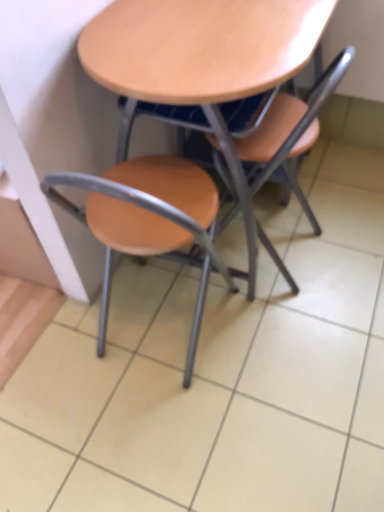
Question: Which direction should I rotate to look at matte wood chair at center, marked as the 2th chair in a right-to-left arrangement?

Choices:
 (A) right
 (B) left

Answer: (B)

Question: From the image's perspective, would you say wooden at center is shown under matte wood chair at center, acting as the first chair starting from the right?

Choices:
 (A) yes
 (B) no

Answer: (B)

Question: From a real-world perspective, is wooden at center on matte wood chair at center, which is the second chair in left-to-right order?

Choices:
 (A) yes
 (B) no

Answer: (A)

Question: From the image's perspective, is wooden at center on top of matte wood chair at center, which is the second chair in left-to-right order?

Choices:
 (A) yes
 (B) no

Answer: (A)

Question: Can matte wood chair at center, which is the second chair in left-to-right order, be found inside wooden at center?

Choices:
 (A) no
 (B) yes

Answer: (B)

Question: Can you confirm if wooden at center is smaller than matte wood chair at center, which is the second chair in left-to-right order?

Choices:
 (A) no
 (B) yes

Answer: (A)

Question: Is wooden at center touching matte wood chair at center, acting as the first chair starting from the right?

Choices:
 (A) no
 (B) yes

Answer: (A)

Question: From the image's perspective, is matte wood chair at center, acting as the first chair starting from the right, located beneath matte wood chair at center, the 1th chair when ordered from left to right?

Choices:
 (A) yes
 (B) no

Answer: (B)

Question: Is matte wood chair at center, acting as the first chair starting from the right, oriented towards matte wood chair at center, marked as the 2th chair in a right-to-left arrangement?

Choices:
 (A) yes
 (B) no

Answer: (B)

Question: Is matte wood chair at center, acting as the first chair starting from the right, further to camera compared to matte wood chair at center, marked as the 2th chair in a right-to-left arrangement?

Choices:
 (A) yes
 (B) no

Answer: (A)

Question: Is matte wood chair at center, which is the second chair in left-to-right order, placed right next to matte wood chair at center, marked as the 2th chair in a right-to-left arrangement?

Choices:
 (A) no
 (B) yes

Answer: (A)

Question: Is matte wood chair at center, the 1th chair when ordered from left to right, located within matte wood chair at center, which is the second chair in left-to-right order?

Choices:
 (A) no
 (B) yes

Answer: (A)

Question: From a real-world perspective, is matte wood chair at center, the 1th chair when ordered from left to right, positioned over wooden at center based on gravity?

Choices:
 (A) no
 (B) yes

Answer: (A)